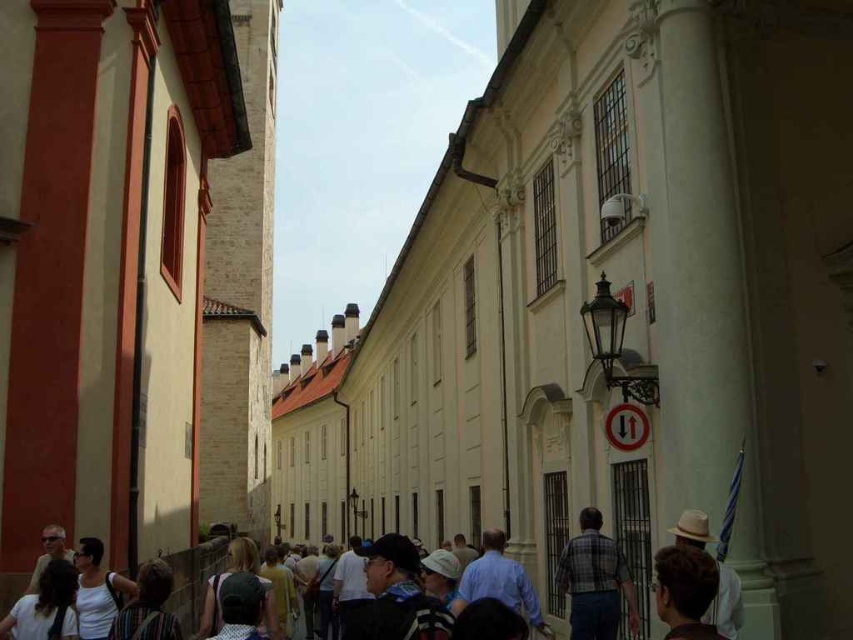
Question: Which point is farther from the camera taking this photo?

Choices:
 (A) (387, 556)
 (B) (585, 577)
 (C) (469, 572)
 (D) (109, 595)

Answer: (C)

Question: Is plaid shirt at center to the left of matte black sunglasses at lower left from the viewer's perspective?

Choices:
 (A) no
 (B) yes

Answer: (A)

Question: Which point is closer to the camera?

Choices:
 (A) (108, 616)
 (B) (570, 589)

Answer: (A)

Question: Can you confirm if dark brown hair at lower left is smaller than dark gray backpack at center?

Choices:
 (A) no
 (B) yes

Answer: (B)

Question: Among these objects, which one is nearest to the camera?

Choices:
 (A) dark blue jacket at center
 (B) dark brown hair at lower left
 (C) dark brown leather backpack at lower left
 (D) matte black sunglasses at lower left

Answer: (A)

Question: Is white cotton tank top at lower left below dark gray backpack at center?

Choices:
 (A) no
 (B) yes

Answer: (A)